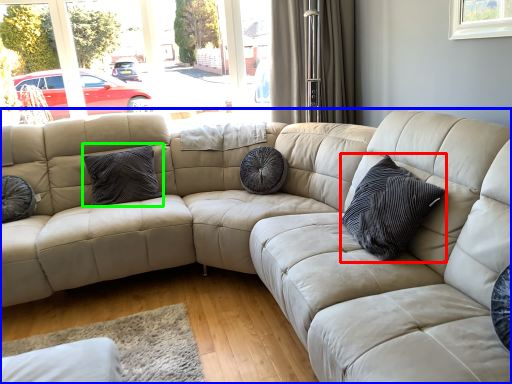
Question: Considering the real-world distances, which object is closest to pillow (highlighted by a red box)? studio couch (highlighted by a blue box) or pillow (highlighted by a green box).

Choices:
 (A) studio couch
 (B) pillow

Answer: (A)